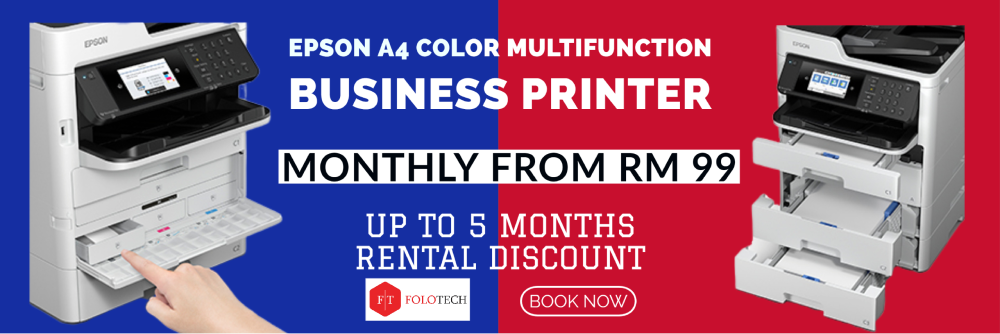
Find the location of a particular element. printer's lcd display is located at coordinates (150, 73), (829, 80).